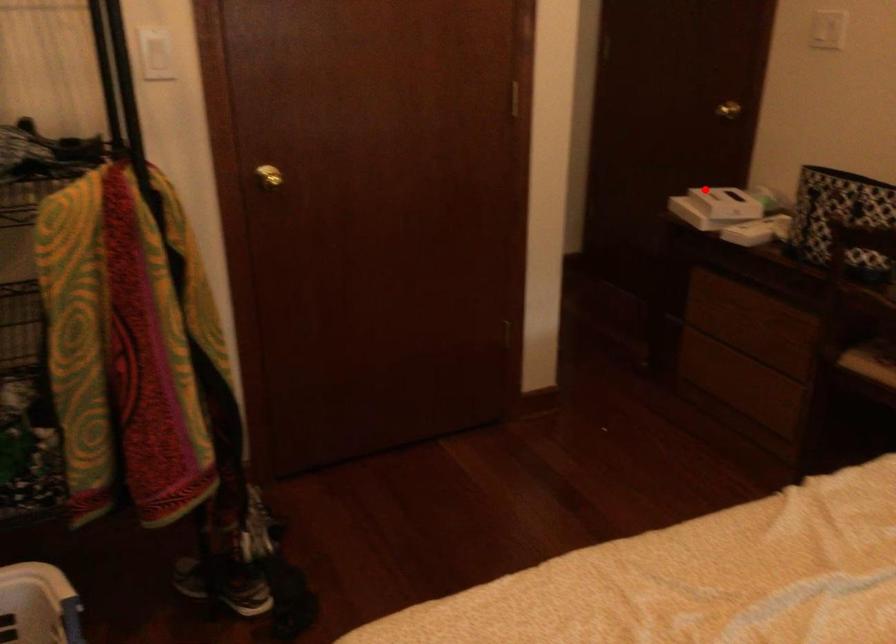
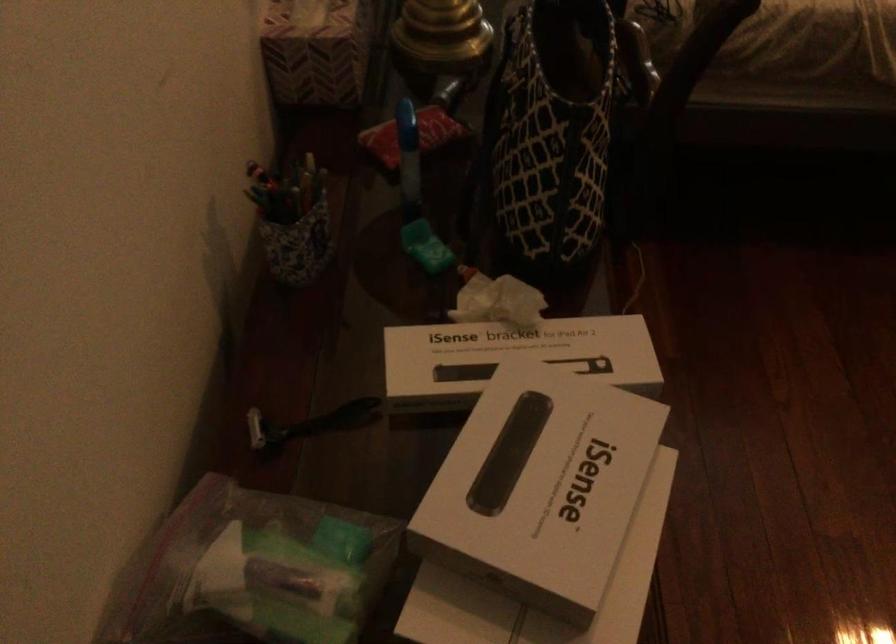
The point at the highlighted location is marked in the first image. Where is the corresponding point in the second image?

(540, 486)